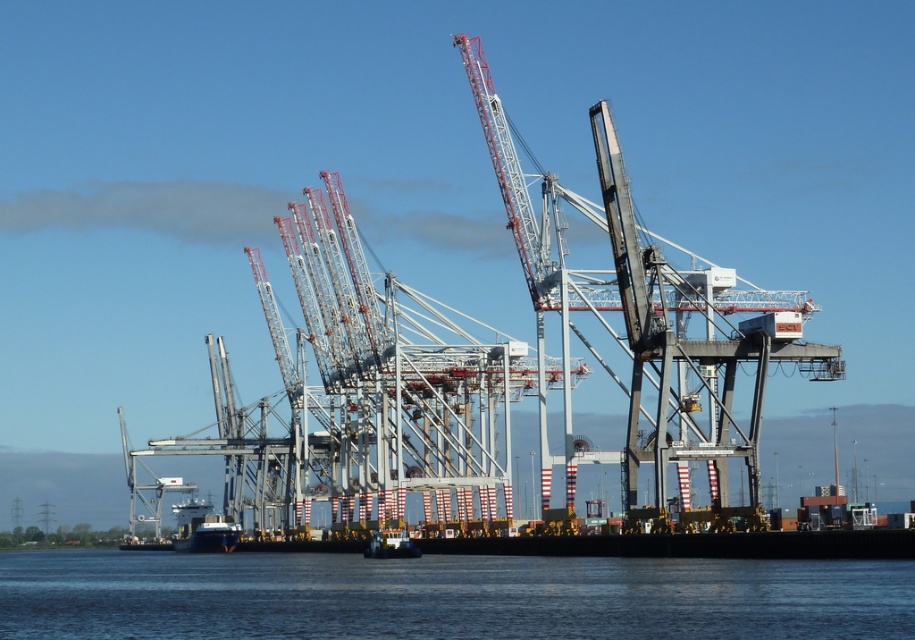
Question: Which is farther from the transparent water at center?

Choices:
 (A) black matte boat at lower center
 (B) metallic gray crane at center

Answer: (A)

Question: Which point is closer to the camera?

Choices:
 (A) (235, 545)
 (B) (665, 273)
 (C) (25, 625)

Answer: (C)

Question: Which point is closer to the camera?

Choices:
 (A) (197, 620)
 (B) (183, 508)

Answer: (A)

Question: Is the position of transparent water at center less distant than that of metallic gray crane at center?

Choices:
 (A) no
 (B) yes

Answer: (B)

Question: Can you confirm if metallic gray crane at center is bigger than black matte boat at lower center?

Choices:
 (A) yes
 (B) no

Answer: (A)

Question: Considering the relative positions of metallic gray crane at center and black matte boat at lower center in the image provided, where is metallic gray crane at center located with respect to black matte boat at lower center?

Choices:
 (A) below
 (B) above

Answer: (B)